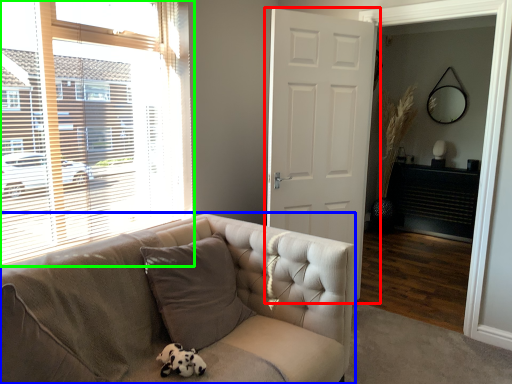
Question: Based on their relative distances, which object is farther from door (highlighted by a red box)? Choose from studio couch (highlighted by a blue box) and window (highlighted by a green box).

Choices:
 (A) studio couch
 (B) window

Answer: (A)